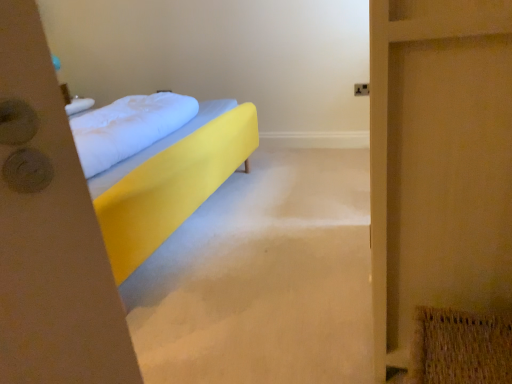
Question: Is yellow fabric bed at center positioned beyond the bounds of white soft pillow at center?

Choices:
 (A) yes
 (B) no

Answer: (A)

Question: From a real-world perspective, is yellow fabric bed at center physically below white soft pillow at center?

Choices:
 (A) no
 (B) yes

Answer: (B)

Question: Is yellow fabric bed at center smaller than white soft pillow at center?

Choices:
 (A) no
 (B) yes

Answer: (A)

Question: Could you tell me if yellow fabric bed at center is turned towards white soft pillow at center?

Choices:
 (A) yes
 (B) no

Answer: (A)

Question: Is yellow fabric bed at center bigger than white soft pillow at center?

Choices:
 (A) no
 (B) yes

Answer: (B)

Question: Is point (154, 109) closer or farther from the camera than point (246, 125)?

Choices:
 (A) farther
 (B) closer

Answer: (B)

Question: From their relative heights in the image, would you say white soft pillow at center is taller or shorter than yellow fabric bed at center?

Choices:
 (A) tall
 (B) short

Answer: (B)

Question: From the image's perspective, is white soft pillow at center above or below yellow fabric bed at center?

Choices:
 (A) above
 (B) below

Answer: (A)

Question: Considering the positions of white soft pillow at center and yellow fabric bed at center in the image, is white soft pillow at center wider or thinner than yellow fabric bed at center?

Choices:
 (A) thin
 (B) wide

Answer: (A)

Question: Looking at the image, does white soft pillow at center seem bigger or smaller compared to wooden screen door at right?

Choices:
 (A) small
 (B) big

Answer: (A)

Question: In the image, is white soft pillow at center on the left side or the right side of wooden screen door at right?

Choices:
 (A) right
 (B) left

Answer: (B)

Question: From the image's perspective, is white soft pillow at center located above or below wooden screen door at right?

Choices:
 (A) below
 (B) above

Answer: (B)

Question: Considering the positions of white soft pillow at center and wooden screen door at right in the image, is white soft pillow at center taller or shorter than wooden screen door at right?

Choices:
 (A) tall
 (B) short

Answer: (B)

Question: Looking at their shapes, would you say wooden screen door at right is wider or thinner than white soft pillow at center?

Choices:
 (A) thin
 (B) wide

Answer: (A)

Question: From a real-world perspective, is wooden screen door at right physically located above or below white soft pillow at center?

Choices:
 (A) above
 (B) below

Answer: (B)